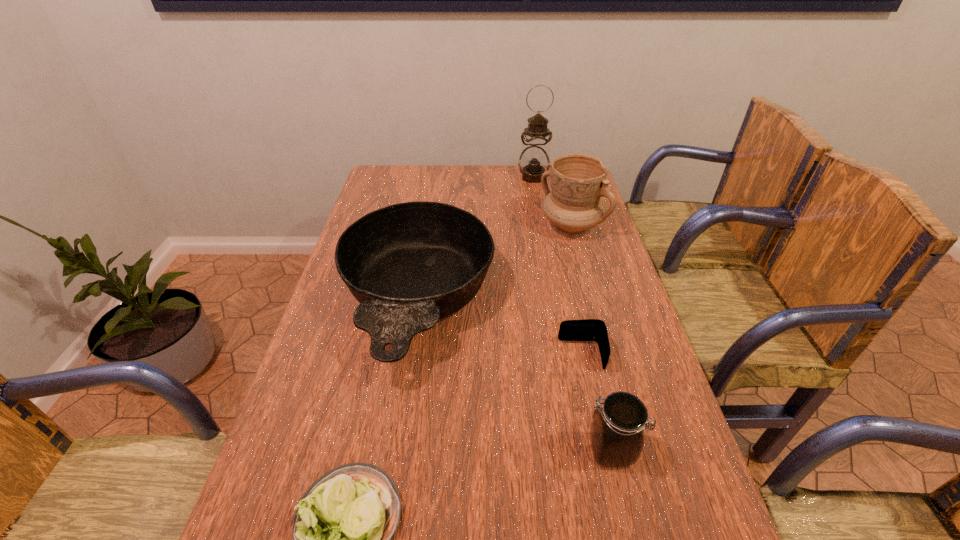
Identify the location of the tallest object. (534, 160).

I want to click on the farthest object, so click(x=534, y=160).

Identify the location of pottery. The image size is (960, 540). point(578,181).

This screenshot has height=540, width=960. In order to click on frying pan in this screenshot , I will do `click(410, 264)`.

This screenshot has width=960, height=540. Find the location of `jar`. jar is located at coordinates [617, 430].

Locate an element on the screen. wallet is located at coordinates (588, 329).

The height and width of the screenshot is (540, 960). Find the location of `vacant point located 0.300m on the front of the tallest object`. vacant point located 0.300m on the front of the tallest object is located at coordinates (543, 229).

I want to click on vacant region located on the left of the fifth shortest object, so click(x=441, y=226).

I want to click on free spot located with the handle extending from the side of the frying pan, so click(399, 418).

Find the location of a particular element. The height and width of the screenshot is (540, 960). vacant area located 0.370m on the lid of the jar is located at coordinates (402, 450).